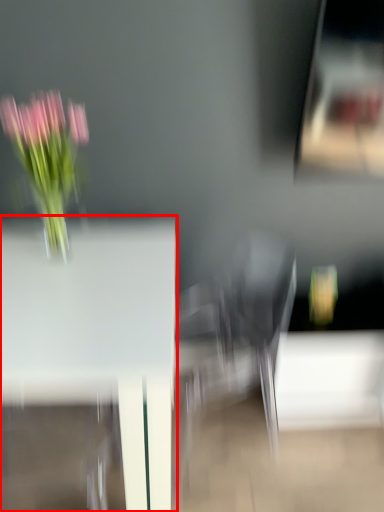
Question: From the image, what is the correct spatial relationship of table (annotated by the red box) in relation to floral arrangement?

Choices:
 (A) right
 (B) left

Answer: (B)